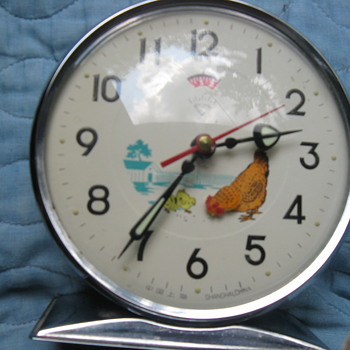
I want to click on blanket behind clock, so click(26, 252).